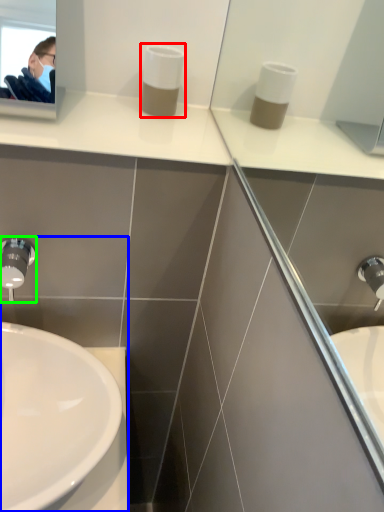
Question: Which object is the farthest from soap dispenser (highlighted by a red box)? Choose among these: sink (highlighted by a blue box) or tap (highlighted by a green box).

Choices:
 (A) sink
 (B) tap

Answer: (A)